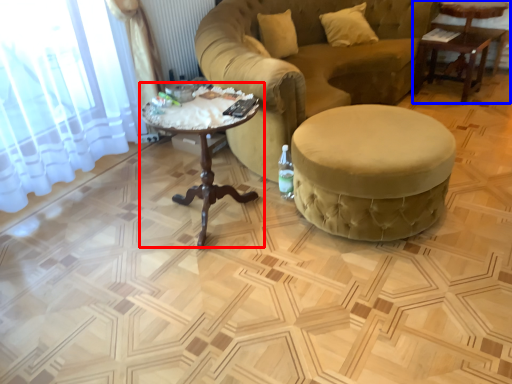
Question: Which object is closer to the camera taking this photo, coffee table (highlighted by a red box) or table (highlighted by a blue box)?

Choices:
 (A) coffee table
 (B) table

Answer: (A)